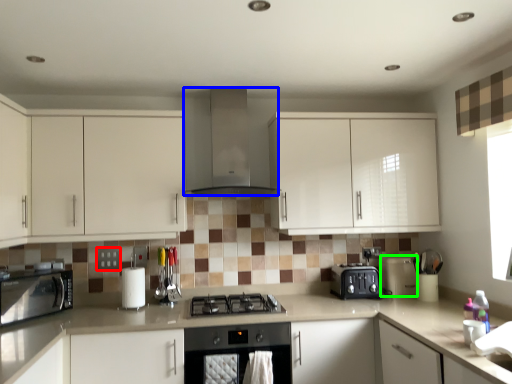
Question: Which is farther away from square (highlighted by a red box)? home appliance (highlighted by a blue box) or appliance (highlighted by a green box)?

Choices:
 (A) home appliance
 (B) appliance

Answer: (B)